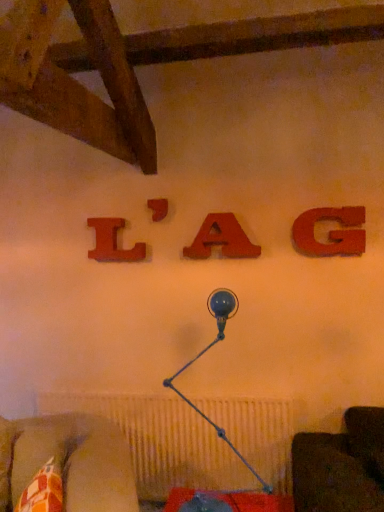
Question: Which direction should I rotate to look at matte wood letter a at center, positioned as the 3th alphabet in left-to-right order, — up or down?

Choices:
 (A) down
 (B) up

Answer: (B)

Question: Is the depth of blue glass table lamp at center greater than that of matte wood letter a at center, positioned as the 3th alphabet in left-to-right order?

Choices:
 (A) no
 (B) yes

Answer: (A)

Question: From the image's perspective, does blue glass table lamp at center appear higher than matte wood letter a at center, placed as the second alphabet when sorted from right to left?

Choices:
 (A) no
 (B) yes

Answer: (A)

Question: Considering the relative sizes of blue glass table lamp at center and matte wood letter a at center, placed as the second alphabet when sorted from right to left, in the image provided, is blue glass table lamp at center taller than matte wood letter a at center, placed as the second alphabet when sorted from right to left,?

Choices:
 (A) yes
 (B) no

Answer: (A)

Question: Would you say blue glass table lamp at center is outside matte wood letter a at center, placed as the second alphabet when sorted from right to left?

Choices:
 (A) no
 (B) yes

Answer: (B)

Question: Does blue glass table lamp at center have a lesser height compared to matte wood letter a at center, positioned as the 3th alphabet in left-to-right order?

Choices:
 (A) no
 (B) yes

Answer: (A)

Question: From a real-world perspective, does blue glass table lamp at center sit lower than matte wood letter a at center, positioned as the 3th alphabet in left-to-right order?

Choices:
 (A) no
 (B) yes

Answer: (B)

Question: Does matte wood letter at center, which ranks as the 2th alphabet in left-to-right order, appear on the right side of matte wood letter a at center, placed as the second alphabet when sorted from right to left?

Choices:
 (A) no
 (B) yes

Answer: (A)

Question: Is matte wood letter at center, which ranks as the 2th alphabet in left-to-right order, oriented away from matte wood letter a at center, positioned as the 3th alphabet in left-to-right order?

Choices:
 (A) no
 (B) yes

Answer: (A)

Question: Can you confirm if matte wood letter at center, which is the 3th alphabet in right-to-left order, is wider than matte wood letter a at center, positioned as the 3th alphabet in left-to-right order?

Choices:
 (A) no
 (B) yes

Answer: (A)

Question: From the image's perspective, is matte wood letter at center, which is the 3th alphabet in right-to-left order, beneath matte wood letter a at center, positioned as the 3th alphabet in left-to-right order?

Choices:
 (A) yes
 (B) no

Answer: (B)

Question: Is matte wood letter a at center, positioned as the 3th alphabet in left-to-right order, a part of matte wood letter at center, which ranks as the 2th alphabet in left-to-right order?

Choices:
 (A) yes
 (B) no

Answer: (B)

Question: Is matte wood letter at center, which ranks as the 2th alphabet in left-to-right order, directly adjacent to matte wood letter a at center, placed as the second alphabet when sorted from right to left?

Choices:
 (A) yes
 (B) no

Answer: (B)

Question: Considering the relative sizes of matte wood letter a at center, positioned as the 3th alphabet in left-to-right order, and blue glass table lamp at center in the image provided, is matte wood letter a at center, positioned as the 3th alphabet in left-to-right order, taller than blue glass table lamp at center?

Choices:
 (A) yes
 (B) no

Answer: (B)